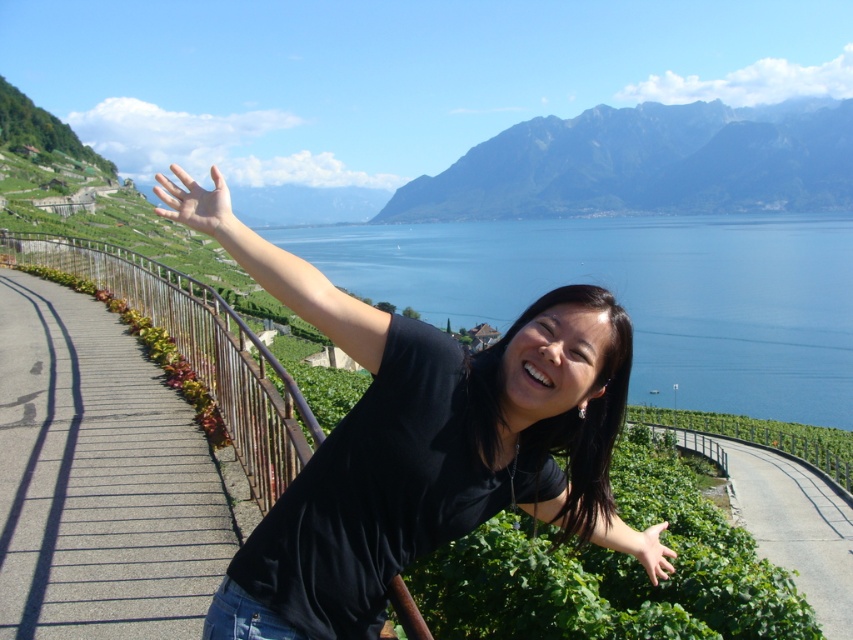
Is matte black arm at upper center positioned before matte skin hand at upper center?

Yes, it is.

The image size is (853, 640). Identify the location of matte black arm at upper center. (276, 268).

Does black matte arm at lower center lie behind matte skin hand at lower center?

No, black matte arm at lower center is closer to the viewer.

Is black matte arm at lower center thinner than matte skin hand at lower center?

In fact, black matte arm at lower center might be wider than matte skin hand at lower center.

Is point (552, 509) positioned after point (634, 545)?

No, it is not.

At what (x,y) coordinates should I click in order to perform the action: click on black matte arm at lower center. Please return your answer as a coordinate pair (x, y). This screenshot has width=853, height=640. Looking at the image, I should click on (635, 545).

Is blue water at center shorter than rugged granite mountain at upper center?

Yes.

From the picture: Between blue water at center and rugged granite mountain at upper center, which one has less height?

With less height is blue water at center.

Identify the location of blue water at center. This screenshot has height=640, width=853. (639, 294).

This screenshot has width=853, height=640. In order to click on blue water at center in this screenshot , I will do `click(639, 294)`.